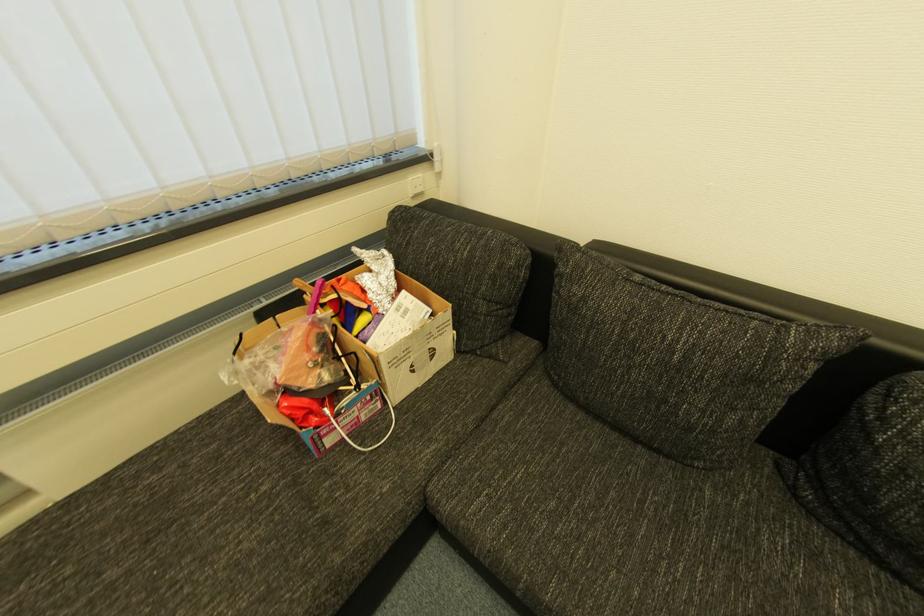
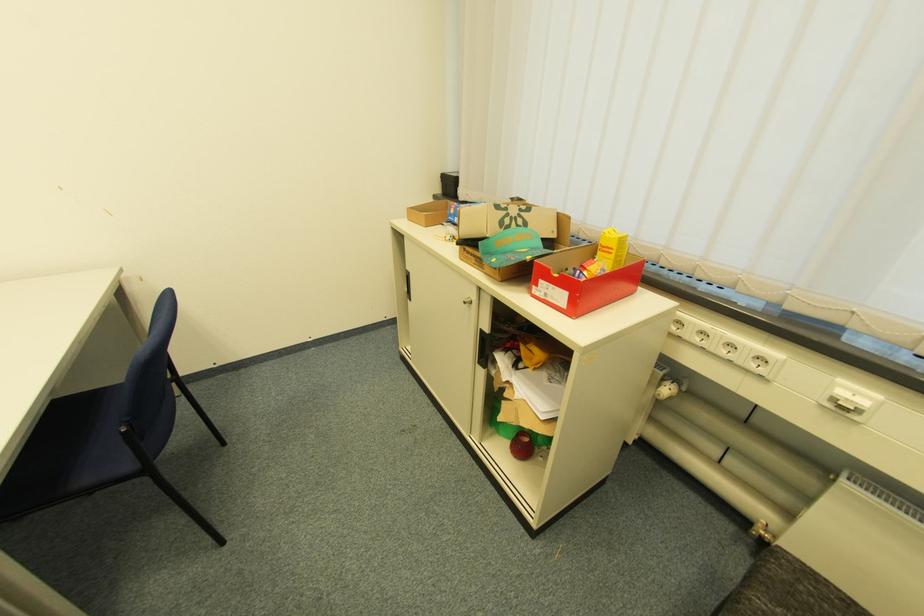
Based on the continuous images, in which direction is the camera rotating?

The rotation direction of the camera is left-down.